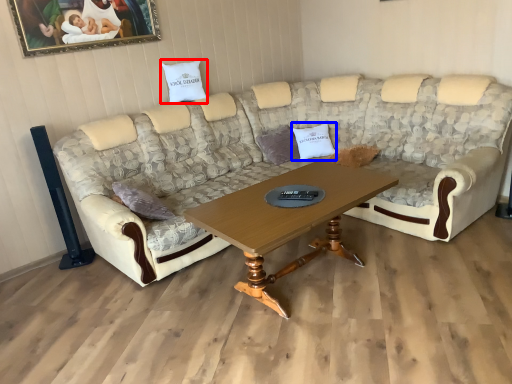
Question: Which object is further to the camera taking this photo, pillow (highlighted by a red box) or pillow (highlighted by a blue box)?

Choices:
 (A) pillow
 (B) pillow

Answer: (B)